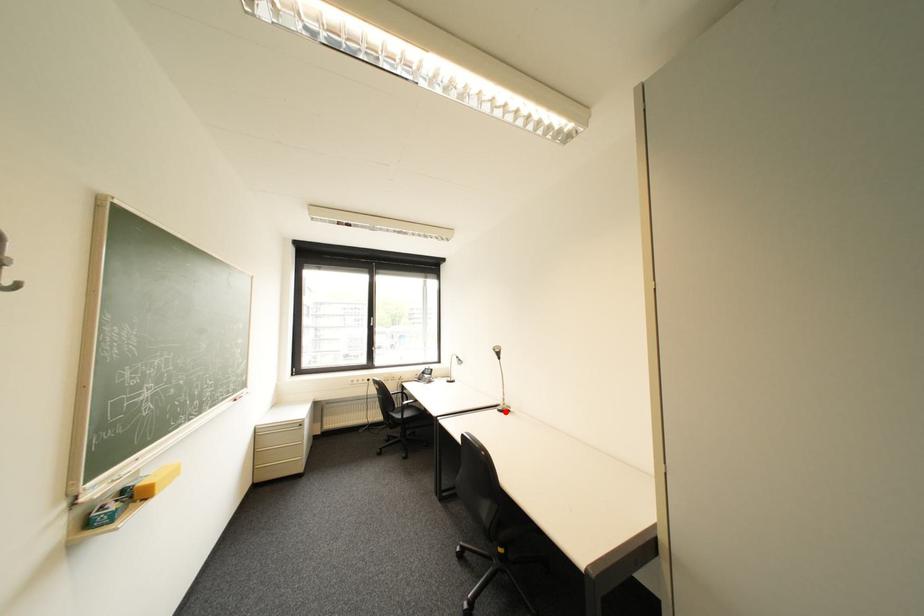
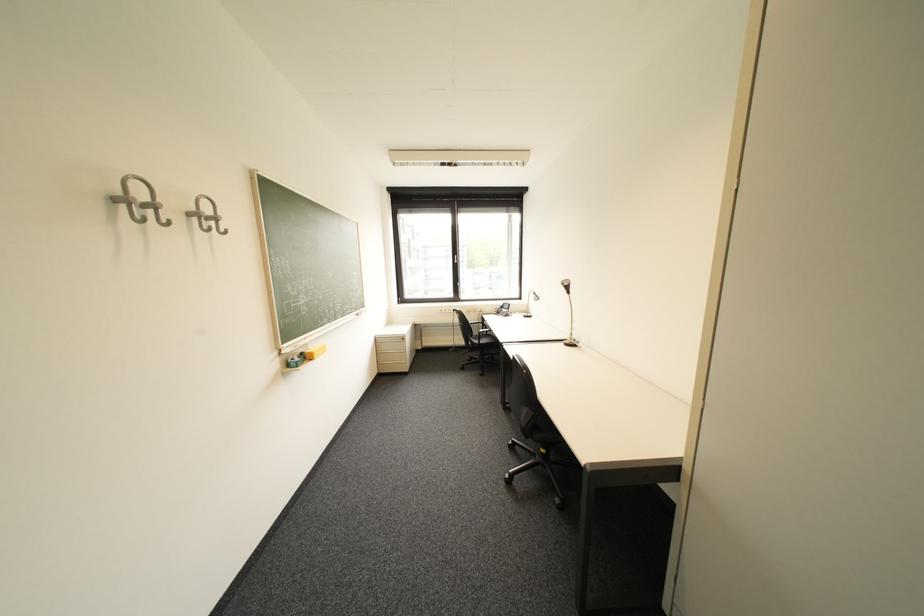
Find the pixel in the second image that matches the highlighted location in the first image.

(572, 345)